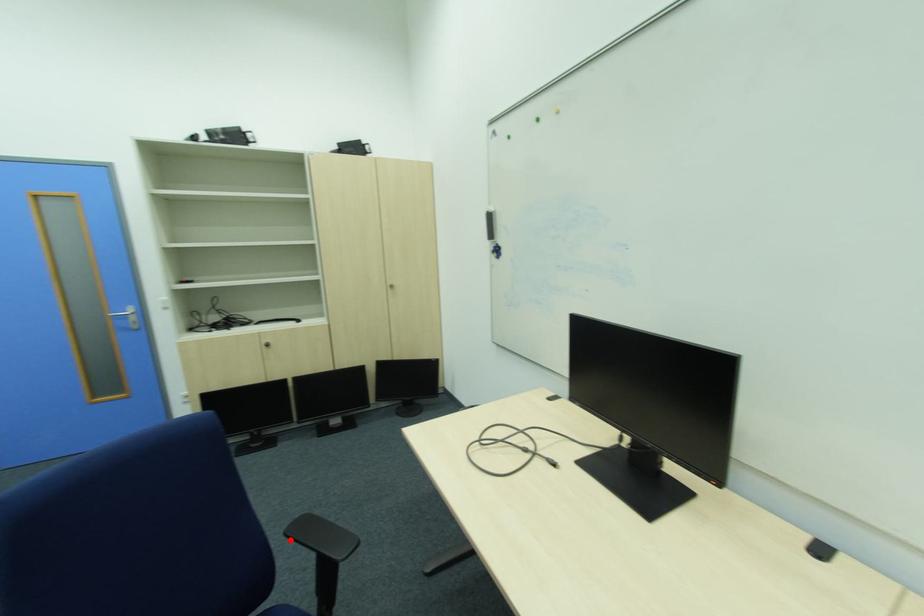
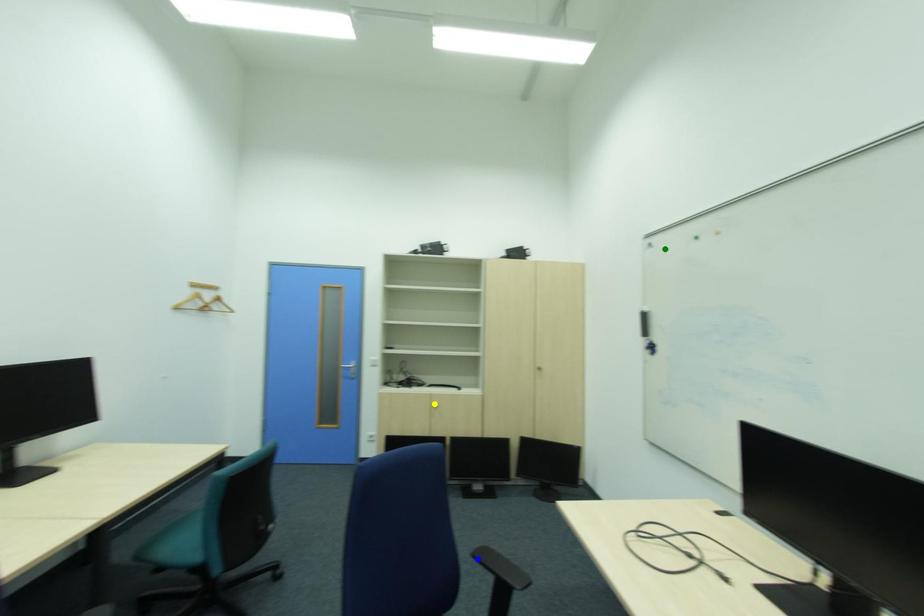
Question: I am providing you with two images of the same scene from different viewpoints. A red point is marked on the first image. You are given multiple points on the second image. In image 2, which mark is for the same physical point as the one in image 1?

Choices:
 (A) yellow point
 (B) blue point
 (C) green point

Answer: (B)